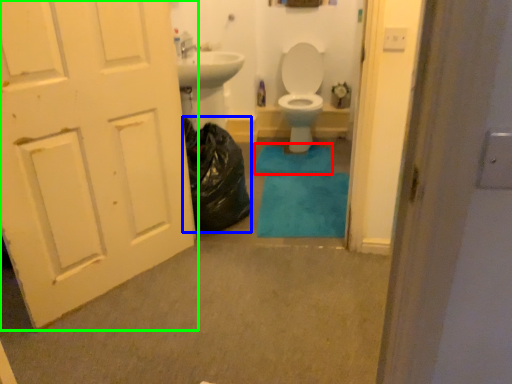
Question: Estimate the real-world distances between objects in this image. Which object is farther from bath mat (highlighted by a red box), garbage (highlighted by a blue box) or door (highlighted by a green box)?

Choices:
 (A) garbage
 (B) door

Answer: (B)